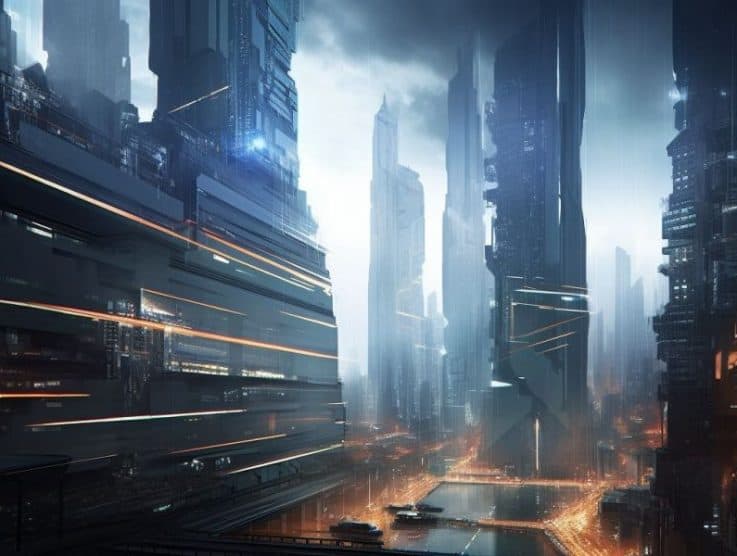
Where is `gold lighting`? gold lighting is located at coordinates (399, 488), (584, 539).